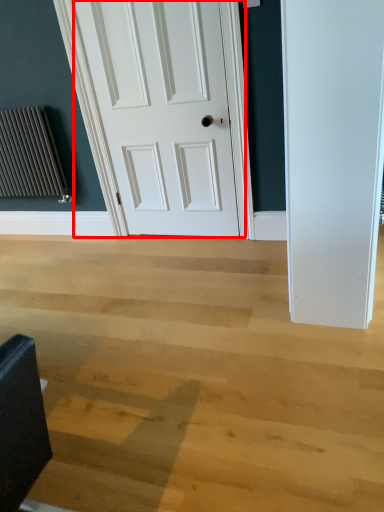
Question: Considering the relative positions of door (annotated by the red box) and radiator in the image provided, where is door (annotated by the red box) located with respect to the staircase?

Choices:
 (A) right
 (B) left

Answer: (A)